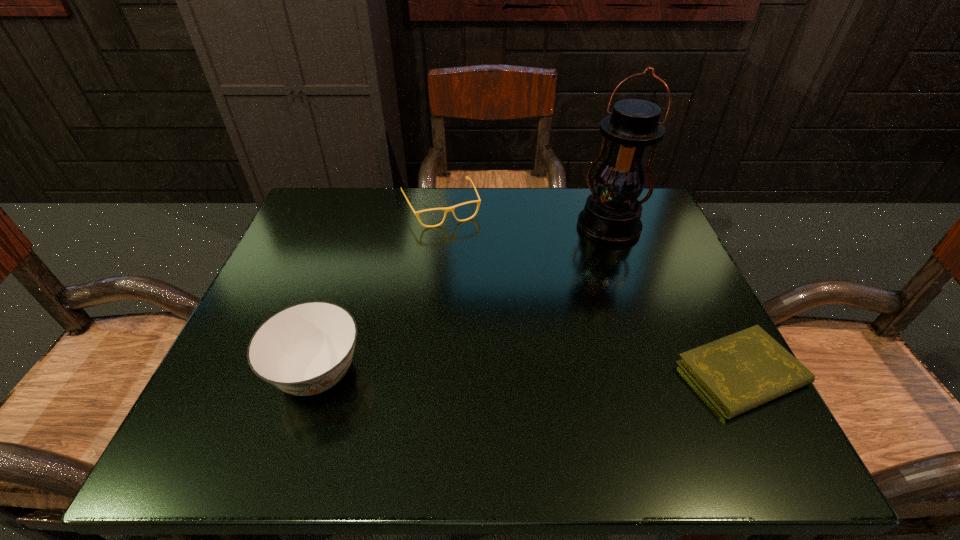
This screenshot has height=540, width=960. I want to click on vacant spot on the desktop that is between the soup bowl and the diary and is positioned above the tallest object, indicating its light source, so click(x=523, y=373).

Where is `free space on the desktop that is between the third shortest object and the shortest object and is positioned in front of the lenses of the spectacles`? free space on the desktop that is between the third shortest object and the shortest object and is positioned in front of the lenses of the spectacles is located at coordinates (520, 373).